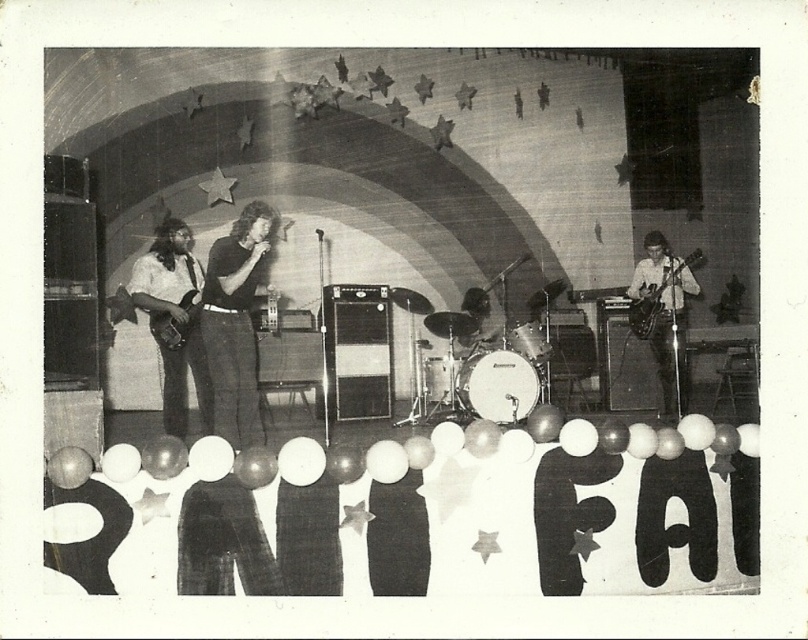
You are a photographer at the back of the venue. You notice the smooth black shirt at center and the shiny black electric guitar at left. Which object is positioned lower in the image?

The smooth black shirt at center is located below the shiny black electric guitar at left, so it is positioned lower in the image.

You are a photographer who wants to focus on the singer with long hair wearing a dark shirt at center. The camera can only focus on objects within a 0.1 unit radius around the point specified. Is the point at coordinates point (234,324) within 0.1 units of the singer with long hair wearing a dark shirt at center?

The point (234,324) is on smooth black shirt at center, so yes, the point is within 0.1 units of the singer with long hair wearing a dark shirt at center since it is directly on their shirt.